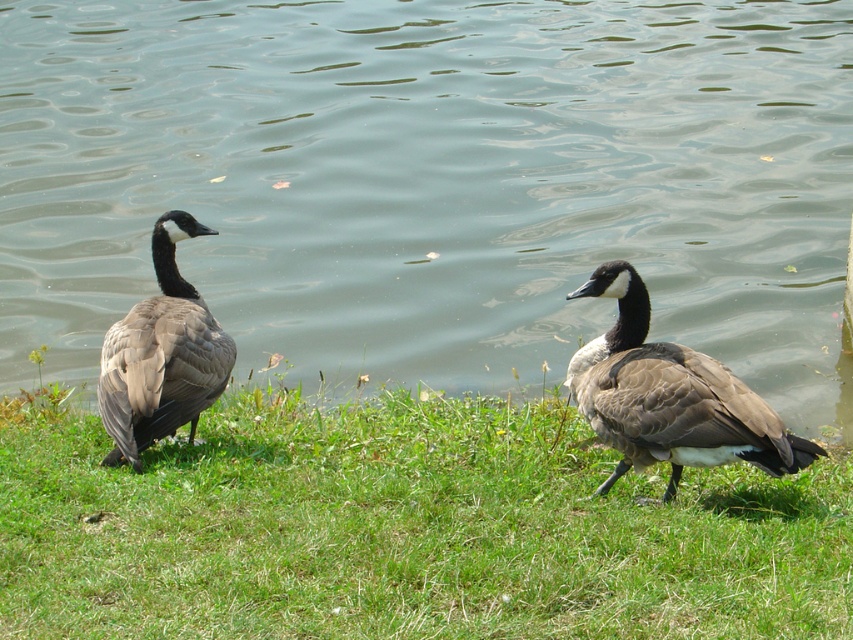
Does point (758, 444) come in front of point (102, 394)?

Yes.

Is brown matte duck at right to the right of brown feathered duck at left from the viewer's perspective?

Correct, you'll find brown matte duck at right to the right of brown feathered duck at left.

Is point (646, 417) behind point (123, 422)?

That is False.

Locate an element on the screen. The height and width of the screenshot is (640, 853). brown matte duck at right is located at coordinates (669, 396).

Between point (3, 579) and point (749, 436), which one is positioned in front?

Positioned in front is point (3, 579).

Between point (328, 573) and point (718, 394), which one is positioned behind?

The point (718, 394) is behind.

Locate an element on the screen. This screenshot has height=640, width=853. green grass at lower left is located at coordinates (407, 531).

What do you see at coordinates (434, 182) in the screenshot?
I see `greenish water at center` at bounding box center [434, 182].

Is greenish water at center to the right of brown feathered duck at left from the viewer's perspective?

No, greenish water at center is not to the right of brown feathered duck at left.

Does point (38, 36) lie in front of point (149, 362)?

No.

Image resolution: width=853 pixels, height=640 pixels. Identify the location of greenish water at center. (434, 182).